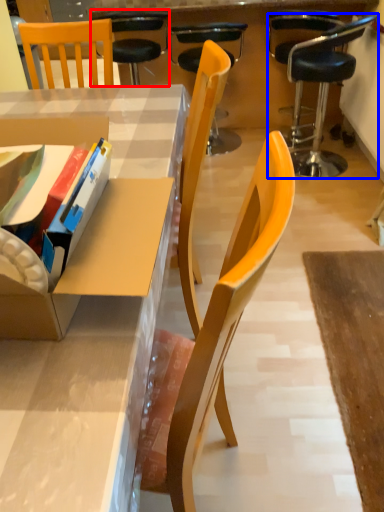
Question: Which object appears closest to the camera in this image, chair (highlighted by a red box) or chair (highlighted by a blue box)?

Choices:
 (A) chair
 (B) chair

Answer: (B)